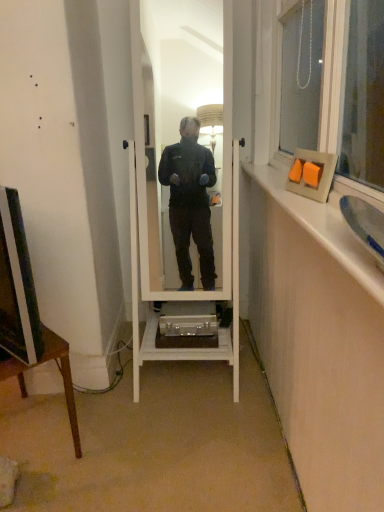
The height and width of the screenshot is (512, 384). Describe the element at coordinates (62, 377) in the screenshot. I see `brown wooden desk at lower left` at that location.

This screenshot has width=384, height=512. Describe the element at coordinates (183, 197) in the screenshot. I see `white wooden mirror at center` at that location.

This screenshot has height=512, width=384. What are the coordinates of `matte orange picture frame at upper right` in the screenshot? It's located at (320, 177).

Measure the distance between matte orange picture frame at upper right and camera.

A distance of 1.24 meters exists between matte orange picture frame at upper right and camera.

In order to click on brown wooden desk at lower left in this screenshot , I will do `click(62, 377)`.

From the image's perspective, which is above, white wooden mirror at center or matte orange picture frame at upper right?

matte orange picture frame at upper right, from the image's perspective.

From a real-world perspective, is white wooden mirror at center physically above matte orange picture frame at upper right?

Actually, white wooden mirror at center is physically below matte orange picture frame at upper right in the real world.

Can you confirm if white wooden mirror at center is positioned to the left of matte orange picture frame at upper right?

Yes, white wooden mirror at center is to the left of matte orange picture frame at upper right.

Is point (25, 307) positioned in front of point (54, 340)?

Yes, point (25, 307) is closer to viewer.

Does matte black television at left turn towards brown wooden desk at lower left?

No, matte black television at left is not turned towards brown wooden desk at lower left.

From the picture: Considering the relative sizes of matte black television at left and brown wooden desk at lower left in the image provided, is matte black television at left bigger than brown wooden desk at lower left?

Incorrect, matte black television at left is not larger than brown wooden desk at lower left.

Find the location of a particular element. desk that appears behind the matte black television at left is located at coordinates click(x=62, y=377).

Considering the relative positions of matte orange picture frame at upper right and white wooden mirror at center in the image provided, is matte orange picture frame at upper right to the right of white wooden mirror at center from the viewer's perspective?

Yes, matte orange picture frame at upper right is to the right of white wooden mirror at center.

Which is in front, point (324, 194) or point (142, 289)?

The point (324, 194) is more forward.

Is matte orange picture frame at upper right not near white wooden mirror at center?

No.

Which of these two, matte orange picture frame at upper right or white wooden mirror at center, stands shorter?

matte orange picture frame at upper right is shorter.

Between matte orange picture frame at upper right and brown wooden desk at lower left, which one has larger width?

Wider between the two is brown wooden desk at lower left.

Where is `picture frame in front of the brown wooden desk at lower left`? This screenshot has width=384, height=512. picture frame in front of the brown wooden desk at lower left is located at coordinates (320, 177).

Is matte orange picture frame at upper right inside or outside of brown wooden desk at lower left?

matte orange picture frame at upper right is located beyond the bounds of brown wooden desk at lower left.

Is matte black television at left at the back of matte orange picture frame at upper right?

No, matte orange picture frame at upper right's orientation is not away from matte black television at left.

From the image's perspective, who appears lower, matte orange picture frame at upper right or matte black television at left?

matte black television at left appears lower in the image.

Can you confirm if matte orange picture frame at upper right is shorter than matte black television at left?

Yes, matte orange picture frame at upper right is shorter than matte black television at left.

From a real-world perspective, does matte orange picture frame at upper right sit lower than matte black television at left?

Actually, matte orange picture frame at upper right is physically above matte black television at left in the real world.

Between point (326, 226) and point (202, 159), which one is positioned in front?

The point (326, 226) is in front.

Is wooden frame at upper right next to white wooden mirror at center and touching it?

No, wooden frame at upper right is not with white wooden mirror at center.

From a real-world perspective, between wooden frame at upper right and white wooden mirror at center, who is vertically lower?

white wooden mirror at center, from a real-world perspective.

How distant is wooden frame at upper right from white wooden mirror at center?

They are 53.13 centimeters apart.

Where is `window sill that is in front of the matte black television at left`? The image size is (384, 512). window sill that is in front of the matte black television at left is located at coordinates (322, 226).

Is wooden frame at upper right taller than matte black television at left?

Incorrect, the height of wooden frame at upper right is not larger of that of matte black television at left.

Are wooden frame at upper right and matte black television at left located far from each other?

That's not correct — wooden frame at upper right is a little close to matte black television at left.

Looking at their sizes, would you say wooden frame at upper right is wider or thinner than matte black television at left?

Considering their sizes, wooden frame at upper right looks broader than matte black television at left.

Image resolution: width=384 pixels, height=512 pixels. Find the location of `mirror that appears below the matte orange picture frame at upper right (from a real-world perspective)`. mirror that appears below the matte orange picture frame at upper right (from a real-world perspective) is located at coordinates (183, 197).

There is a brown wooden desk at lower left. At what (x,y) coordinates should I click in order to perform the action: click on television above it (from a real-world perspective). Please return your answer as a coordinate pair (x, y). The image size is (384, 512). Looking at the image, I should click on (x=17, y=285).

When comparing their distances from brown wooden desk at lower left, does white wooden mirror at center or matte orange picture frame at upper right seem further?

The object further to brown wooden desk at lower left is matte orange picture frame at upper right.

From the image, which object appears to be nearer to matte orange picture frame at upper right, brown wooden desk at lower left or white wooden mirror at center?

white wooden mirror at center.

Which object lies nearer to the anchor point matte black television at left, brown wooden desk at lower left or white wooden mirror at center?

brown wooden desk at lower left is positioned closer to the anchor matte black television at left.

From the image, which object appears to be farther from brown wooden desk at lower left, wooden frame at upper right or matte black television at left?

Based on the image, wooden frame at upper right appears to be further to brown wooden desk at lower left.

Looking at the image, which one is located further to white wooden mirror at center, wooden frame at upper right or brown wooden desk at lower left?

brown wooden desk at lower left.

From the image, which object appears to be farther from white wooden mirror at center, brown wooden desk at lower left or wooden frame at upper right?

Based on the image, brown wooden desk at lower left appears to be further to white wooden mirror at center.

Based on their spatial positions, is brown wooden desk at lower left or matte black television at left further from white wooden mirror at center?

matte black television at left is positioned further to the anchor white wooden mirror at center.

Which object lies nearer to the anchor point white wooden mirror at center, matte black television at left or brown wooden desk at lower left?

brown wooden desk at lower left lies closer to white wooden mirror at center than the other object.

The width and height of the screenshot is (384, 512). What are the coordinates of `mirror between brown wooden desk at lower left and wooden frame at upper right` in the screenshot? It's located at (183, 197).

Where is `mirror between matte black television at left and matte orange picture frame at upper right from left to right`? The image size is (384, 512). mirror between matte black television at left and matte orange picture frame at upper right from left to right is located at coordinates (183, 197).

Find the location of a particular element. This screenshot has width=384, height=512. television between brown wooden desk at lower left and wooden frame at upper right is located at coordinates (17, 285).

Identify the location of window sill located between brown wooden desk at lower left and matte orange picture frame at upper right in the left-right direction. (322, 226).